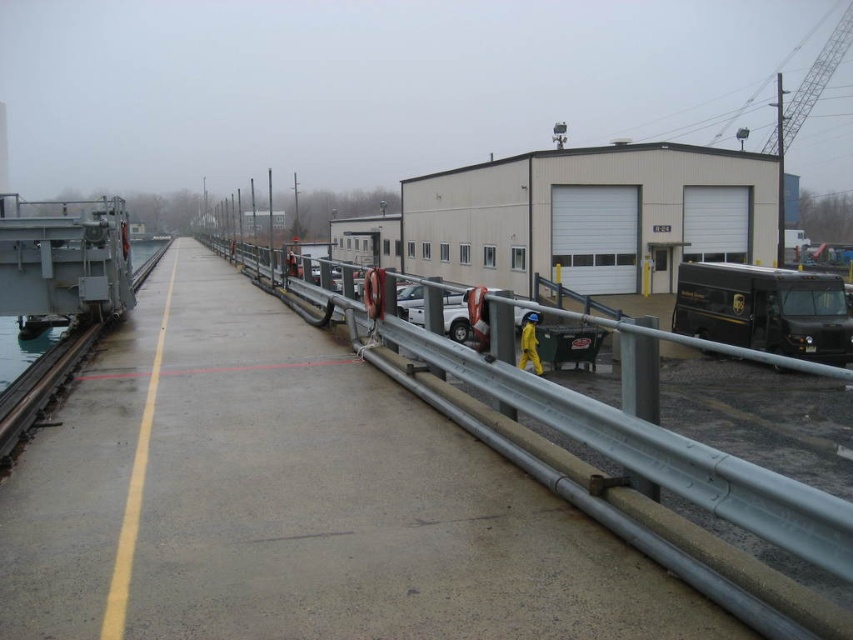
Question: Is metal at center positioned before gray metallic train track at left?

Choices:
 (A) yes
 (B) no

Answer: (A)

Question: Is the position of metal at center less distant than that of gray metallic train track at left?

Choices:
 (A) no
 (B) yes

Answer: (B)

Question: Considering the relative positions of metal at center and gray metallic train track at left in the image provided, where is metal at center located with respect to gray metallic train track at left?

Choices:
 (A) above
 (B) below

Answer: (A)